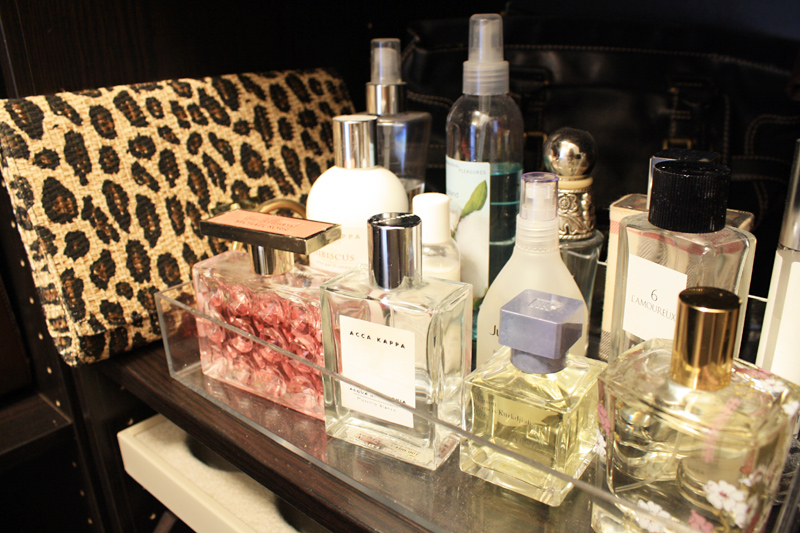
Locate an element on the screen. The image size is (800, 533). place to put perfume is located at coordinates (444, 496).